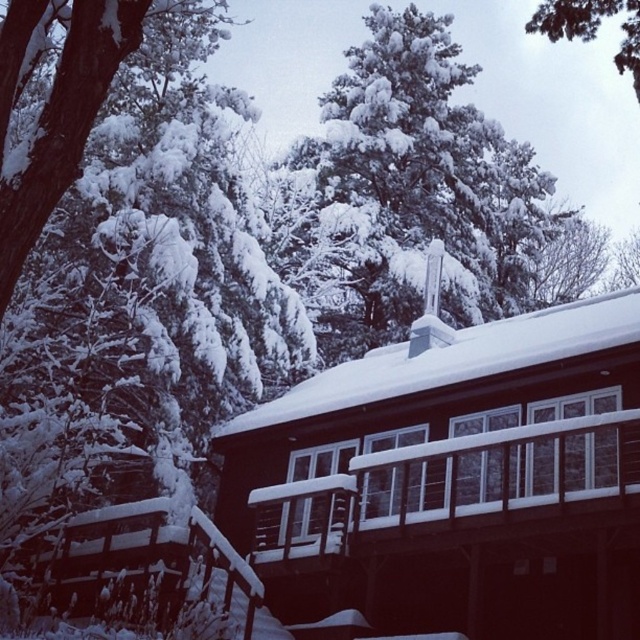
Between snow-covered cabin at center and snow-covered pine tree at upper center, which one is positioned higher?

snow-covered pine tree at upper center

Find the location of `snow-covered cabin at center`. snow-covered cabin at center is located at coordinates (451, 480).